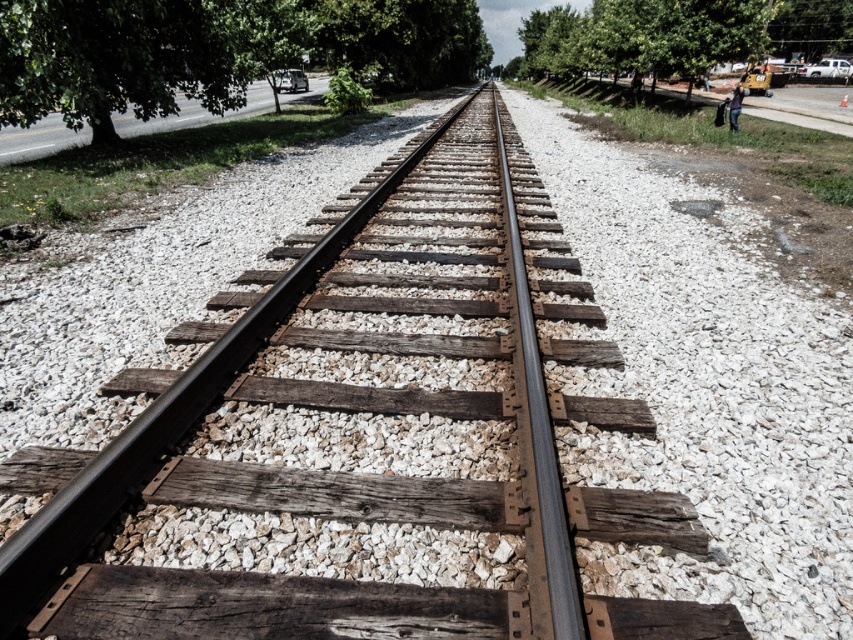
Question: Is green leafy tree at upper left thinner than green leafy tree at upper right?

Choices:
 (A) no
 (B) yes

Answer: (B)

Question: Can you confirm if green leafy tree at upper left is positioned to the left of green leafy tree at upper right?

Choices:
 (A) yes
 (B) no

Answer: (A)

Question: Which object is closer to the camera taking this photo?

Choices:
 (A) green leafy tree at upper right
 (B) green leafy tree at upper left

Answer: (B)

Question: Which point is closer to the camera?

Choices:
 (A) green leafy tree at upper right
 (B) green leafy tree at upper left

Answer: (B)

Question: Can you confirm if green leafy tree at upper left is positioned to the left of green leafy tree at upper right?

Choices:
 (A) yes
 (B) no

Answer: (A)